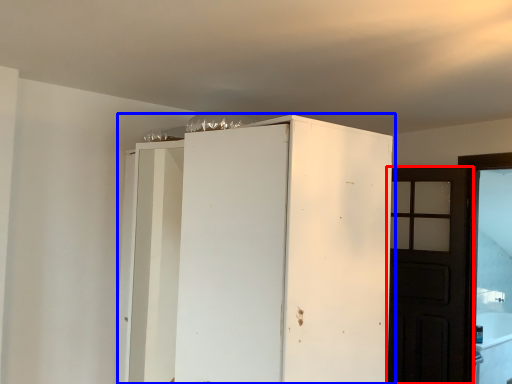
Question: Among these objects, which one is farthest to the camera, door (highlighted by a red box) or cupboard (highlighted by a blue box)?

Choices:
 (A) door
 (B) cupboard

Answer: (A)